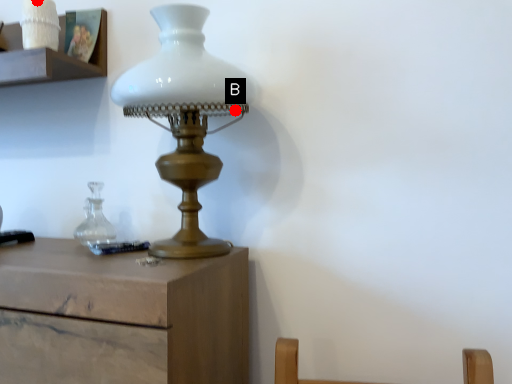
Question: Two points are circled on the image, labeled by A and B beside each circle. Among these points, which one is farthest from the camera?

Choices:
 (A) A is further
 (B) B is further

Answer: (A)